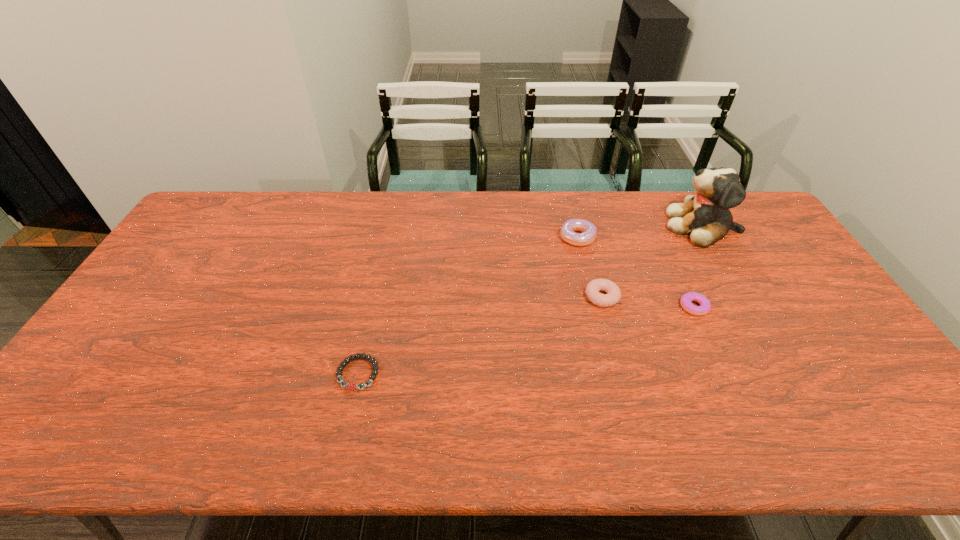
Where is `free region at the near edge of the desktop`? The image size is (960, 540). free region at the near edge of the desktop is located at coordinates (282, 418).

In the image, there is a desktop. At what (x,y) coordinates should I click in order to perform the action: click on free space at the right edge. Please return your answer as a coordinate pair (x, y). This screenshot has width=960, height=540. Looking at the image, I should click on 770,262.

You are a GUI agent. You are given a task and a screenshot of the screen. Output one action in this format:
    pyautogui.click(x=<x>, y=<y>)
    Task: Click on the vacant space at the far left corner of the desktop
    The width and height of the screenshot is (960, 540).
    Given the screenshot: What is the action you would take?
    pyautogui.click(x=236, y=192)

Where is `vacant space that is in between the tallest object and the third tallest object`? The height and width of the screenshot is (540, 960). vacant space that is in between the tallest object and the third tallest object is located at coordinates (652, 261).

You are a GUI agent. You are given a task and a screenshot of the screen. Output one action in this format:
    pyautogui.click(x=<x>, y=<y>)
    Task: Click on the free spot between the leftmost object and the rightmost doughnut
    
    Given the screenshot: What is the action you would take?
    pyautogui.click(x=526, y=340)

Find the location of a particular element. The image size is (960, 540). unoccupied position between the second tallest object and the third shortest object is located at coordinates (589, 267).

Locate an element on the screen. vacant space that is in between the puppy and the bracelet is located at coordinates (530, 300).

The width and height of the screenshot is (960, 540). What are the coordinates of `blank region between the tallest object and the second tallest doughnut` in the screenshot? It's located at (652, 261).

Where is `free area in between the shortest doughnut and the third shortest object`? free area in between the shortest doughnut and the third shortest object is located at coordinates [x=648, y=302].

At what (x,y) coordinates should I click in order to perform the action: click on empty space between the tallest object and the nearest object. Please return your answer as a coordinate pair (x, y). The width and height of the screenshot is (960, 540). Looking at the image, I should click on pyautogui.click(x=530, y=300).